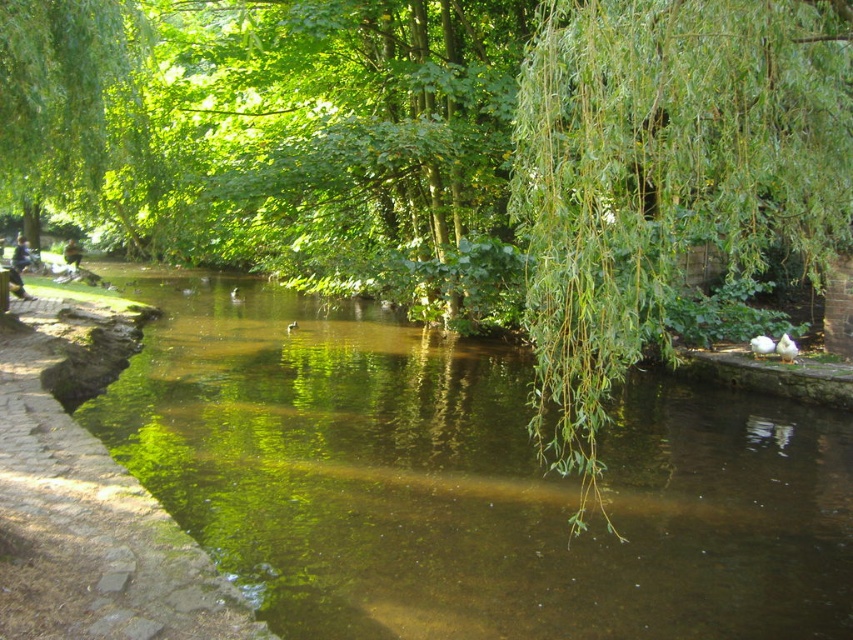
Question: Is green reflective water at center smaller than green leafy willow at right?

Choices:
 (A) no
 (B) yes

Answer: (B)

Question: Does green reflective water at center have a larger size compared to brown stone path at left?

Choices:
 (A) no
 (B) yes

Answer: (B)

Question: Considering the relative positions of green reflective water at center and brown stone path at left in the image provided, where is green reflective water at center located with respect to brown stone path at left?

Choices:
 (A) above
 (B) below

Answer: (B)

Question: Among these points, which one is nearest to the camera?

Choices:
 (A) (88, 436)
 (B) (570, 272)

Answer: (B)

Question: Which object is farther from the camera taking this photo?

Choices:
 (A) brown stone path at left
 (B) green leafy willow at right
 (C) green reflective water at center

Answer: (C)

Question: Considering the real-world distances, which object is farthest from the green leafy willow at right?

Choices:
 (A) brown stone path at left
 (B) green reflective water at center

Answer: (A)